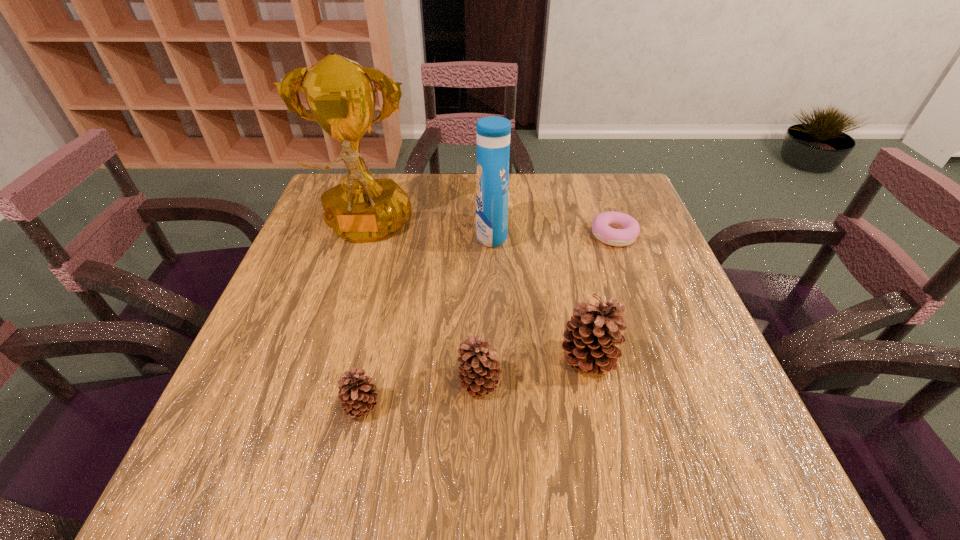
Image resolution: width=960 pixels, height=540 pixels. What are the coordinates of `object situated at the left edge` in the screenshot? It's located at (340, 94).

Find the location of a particular element. This screenshot has height=540, width=960. object present at the right edge is located at coordinates (603, 227).

Identify the location of object present at the far left corner. (340, 94).

The height and width of the screenshot is (540, 960). In order to click on blank area at the far edge in this screenshot , I will do `click(532, 214)`.

Locate an element on the screen. This screenshot has height=540, width=960. vacant point at the left edge is located at coordinates (318, 374).

Where is `blank area at the right edge`? The width and height of the screenshot is (960, 540). blank area at the right edge is located at coordinates (635, 310).

Locate an element on the screen. This screenshot has width=960, height=540. blank space at the near left corner is located at coordinates (291, 413).

The width and height of the screenshot is (960, 540). I want to click on vacant space at the far right corner of the desktop, so click(604, 176).

Where is `vacant position at the near right corner of the desktop`? vacant position at the near right corner of the desktop is located at coordinates (690, 412).

This screenshot has width=960, height=540. Identify the location of vacant space that's between the detergent and the pastry. (553, 235).